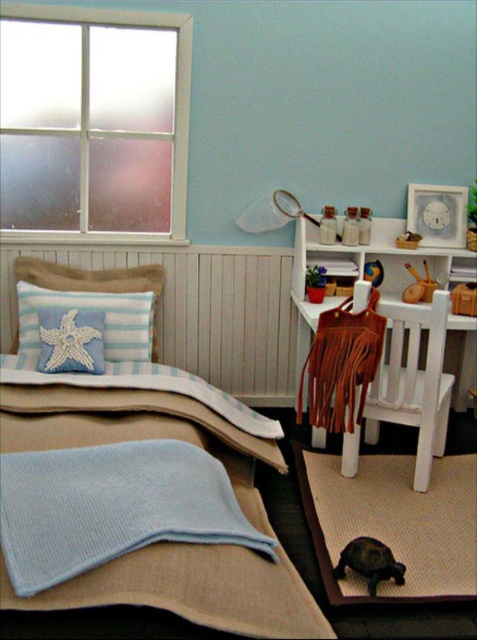
Question: Can you confirm if blue knitted blanket at lower left is thinner than blue textured pillow at upper left?

Choices:
 (A) yes
 (B) no

Answer: (B)

Question: Considering the real-world distances, which object is closest to the blue textured blanket at lower left?

Choices:
 (A) blue textured pillow at upper left
 (B) matte glass jar at upper center

Answer: (A)

Question: Can you confirm if light blue knitted blanket at lower left is positioned above black rubber turtle at lower right?

Choices:
 (A) no
 (B) yes

Answer: (B)

Question: Which object is closer to the camera taking this photo?

Choices:
 (A) frosted glass window at upper left
 (B) blue knitted blanket at lower left
 (C) blue textured blanket at lower left

Answer: (C)

Question: Which of the following is the farthest from the observer?

Choices:
 (A) (358, 528)
 (B) (270, 465)
 (C) (332, 216)

Answer: (C)

Question: Is frosted glass window at upper left positioned in front of blue textured pillow at upper left?

Choices:
 (A) no
 (B) yes

Answer: (A)